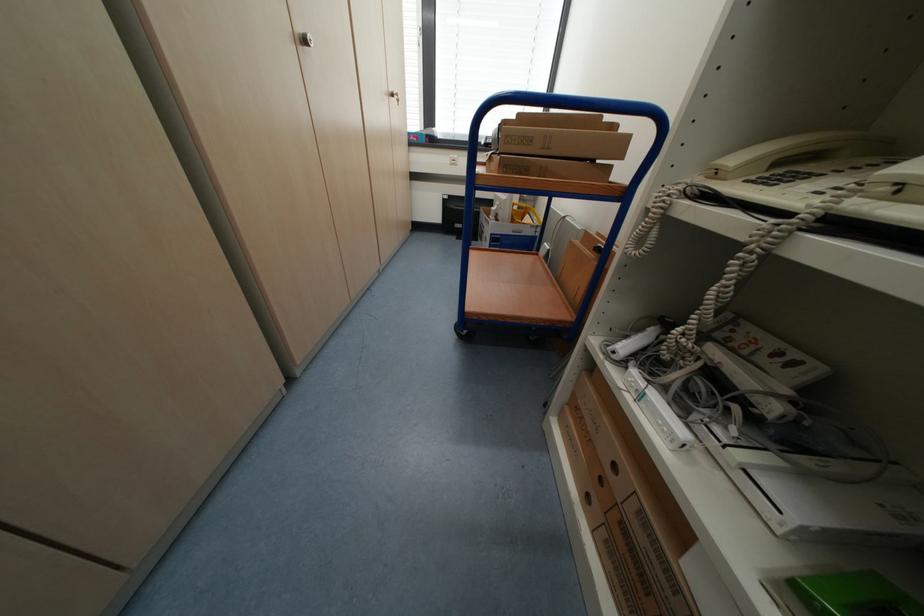
Where would you pull the binder finger hole? Please return your answer as a coordinate pair (x, y).

(600, 485)